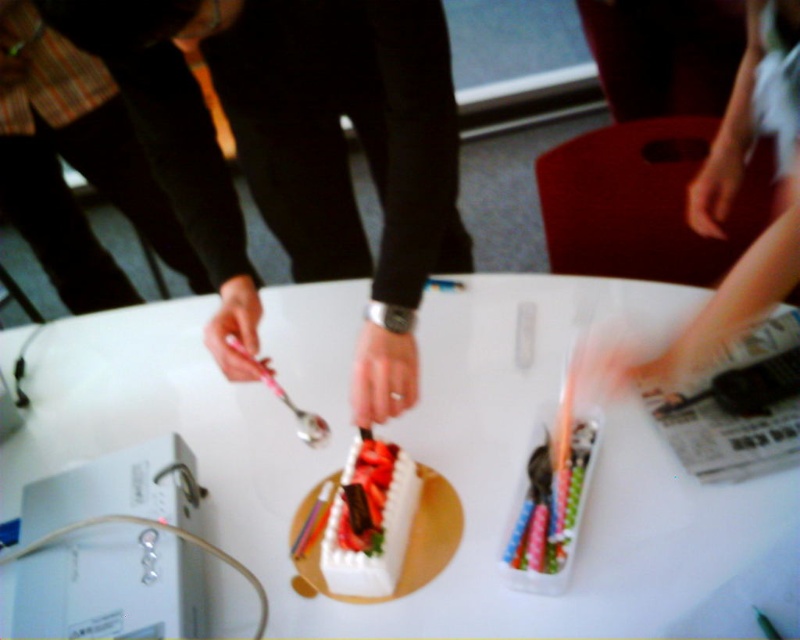
You are planning to place a large birthday cake on the table. Given the sizes of the white plastic table at center and the smooth white arm at upper right, will the cake fit comfortably on the table without being too close to the edge?

The white plastic table at center has a larger size compared to the smooth white arm at upper right, so the cake should fit comfortably on the table without being too close to the edge.

You are standing in the room and want to place a small gift on the table. Which object, the white plastic table at center or the smooth skin hand at upper right, should you aim for to ensure it lands on the table?

You should aim for the white plastic table at center because it is closer to the viewer and the hand is reaching towards it, indicating the table is the correct surface for placing the gift.